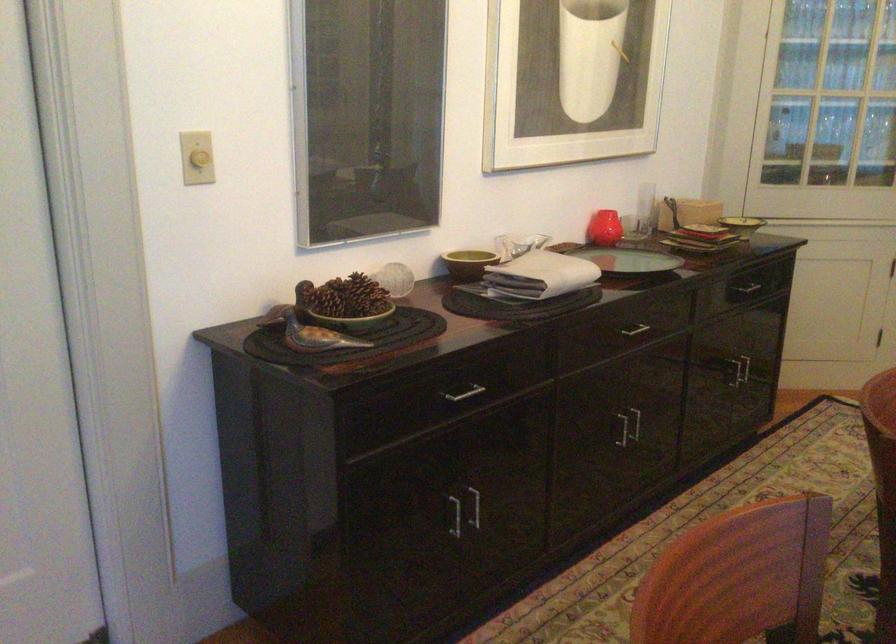
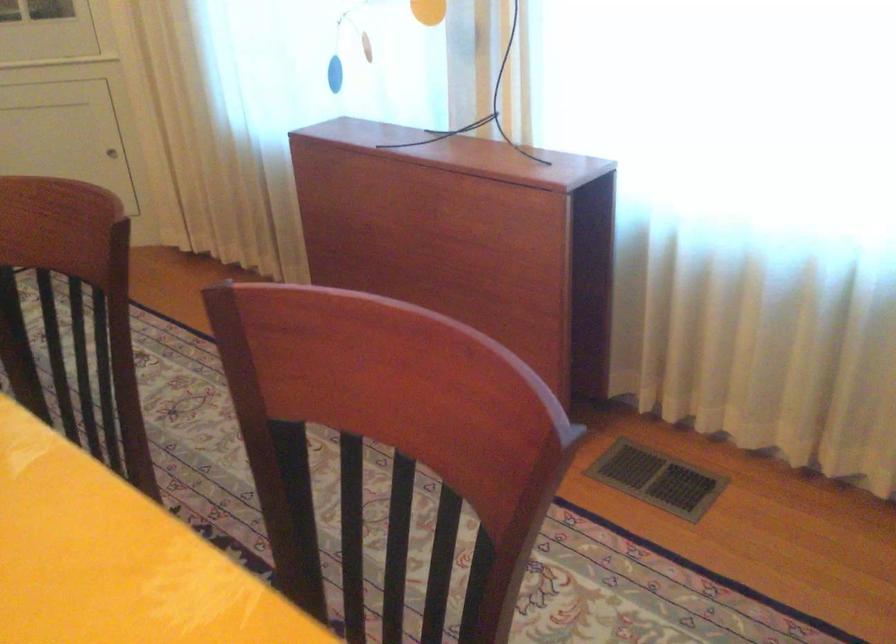
From the picture: The images are taken continuously from a first-person perspective. In which direction is your viewpoint rotating?

The rotation direction of the camera is right-down.